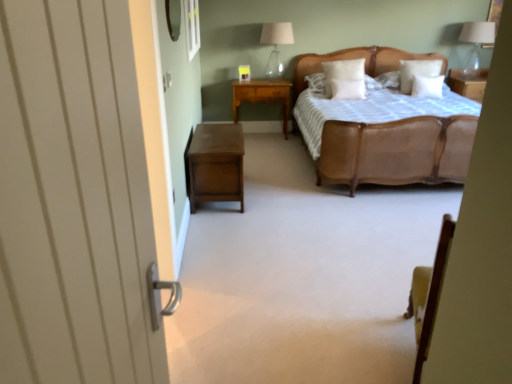
The width and height of the screenshot is (512, 384). What are the coordinates of `vacant area that lies between brown wood nightstand at lower left, acting as the 2th nightstand starting from the back, and leather bed at center` in the screenshot? It's located at (293, 176).